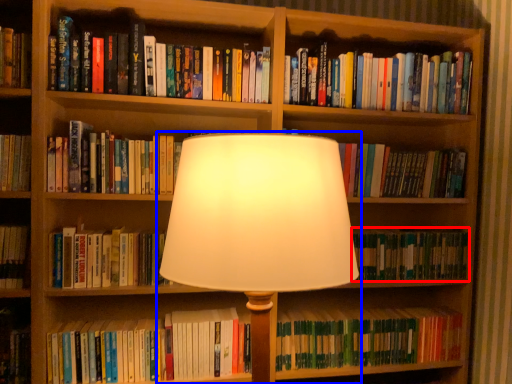
Question: Which object appears farthest to the camera in this image, book (highlighted by a red box) or lamp (highlighted by a blue box)?

Choices:
 (A) book
 (B) lamp

Answer: (A)